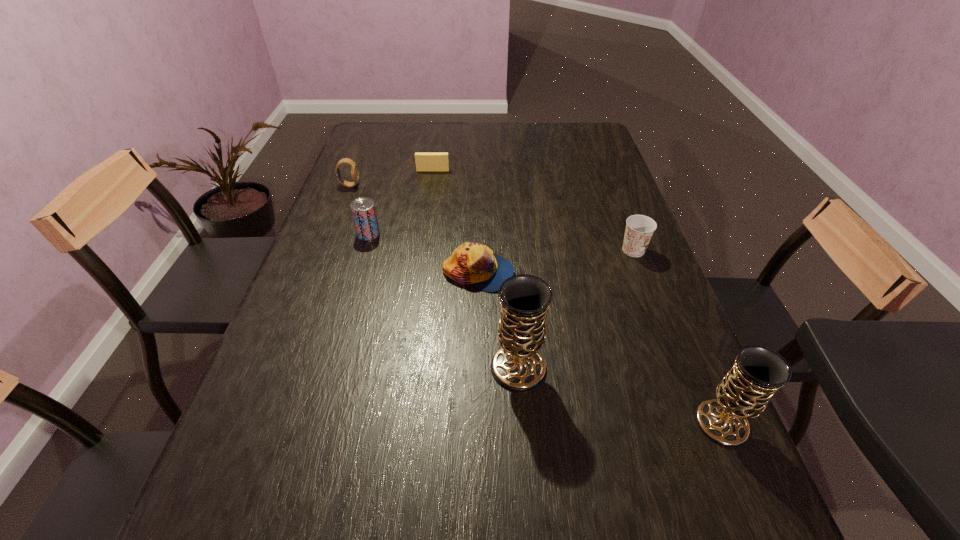
This screenshot has height=540, width=960. Find the location of `watch present at the left edge`. watch present at the left edge is located at coordinates (354, 168).

The image size is (960, 540). I want to click on beer can located at the left edge, so click(x=363, y=209).

Image resolution: width=960 pixels, height=540 pixels. Find the location of `chalice positioned at the right edge`. chalice positioned at the right edge is located at coordinates (758, 372).

What are the coordinates of `Dixie cup located in the right edge section of the desktop` in the screenshot? It's located at (639, 229).

This screenshot has width=960, height=540. Identify the location of object that is at the near right corner. point(758,372).

Locate an element on the screen. Image resolution: width=960 pixels, height=540 pixels. vacant region at the far edge of the desktop is located at coordinates (408, 131).

The image size is (960, 540). I want to click on vacant point at the near edge, so click(x=346, y=449).

Locate an element on the screen. free space at the left edge of the desktop is located at coordinates (357, 191).

In the image, there is a desktop. Identify the location of free space at the right edge. This screenshot has height=540, width=960. (704, 390).

Image resolution: width=960 pixels, height=540 pixels. In order to click on vacant space at the far left corner of the desktop in this screenshot , I will do `click(360, 151)`.